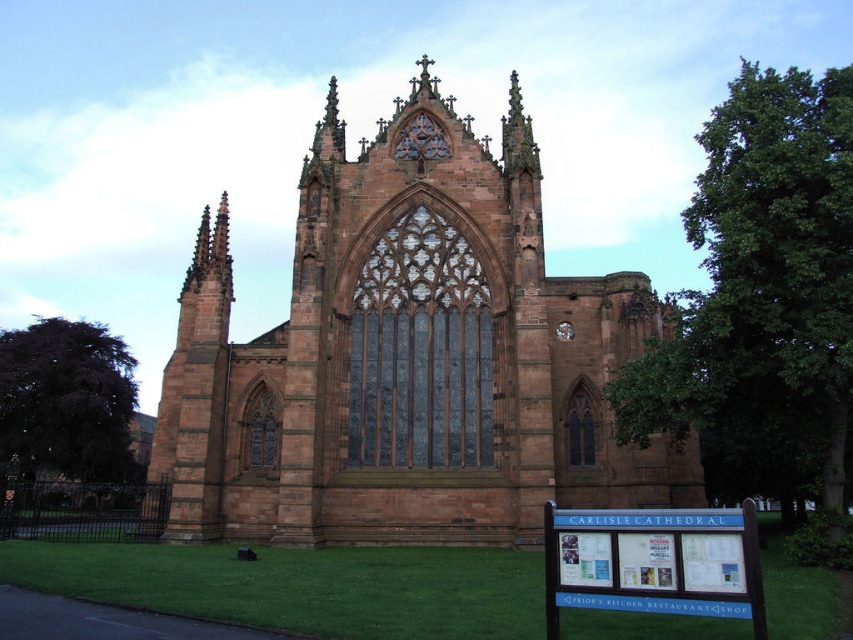
You are standing at the entrance of Carlisle Cathedral and want to find the green grass at lower center. According to the coordinates provided, where exactly is the green grass located?

The green grass at lower center is located at coordinates point (303, 586).

You are standing in front of the cathedral and want to take a photo that includes both the brown stone church at center and the green grass at lower center. Which direction should you move to ensure both are visible in the frame?

You should move to the left so that the brown stone church at center, which is to the right of the green grass at lower center, comes into view alongside the grass.

You are standing at the entrance of Carlisle Cathedral and notice two points marked in the scene. The first point is at coordinates point (424,364) and the second point is at point (396,612). Which point is closer to you from your current position?

Point (396,612) is closer to you because it is in front of point (424,364) according to their spatial arrangement.